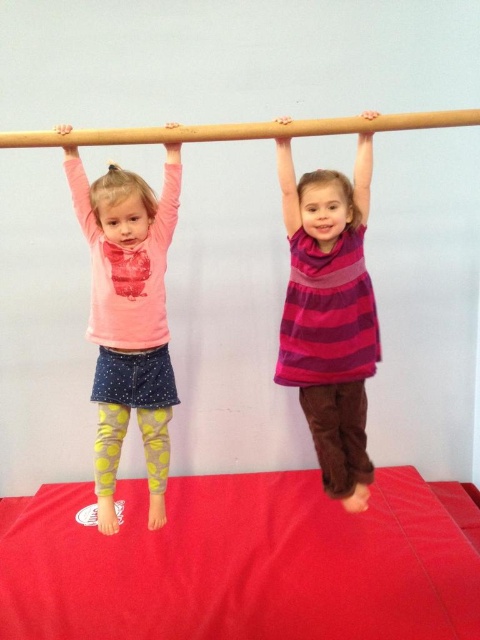
Does pink matte shirt at left have a greater height compared to wooden pole at center?

Answer: Correct, pink matte shirt at left is much taller as wooden pole at center.

Looking at this image, which is more to the left, pink matte shirt at left or wooden pole at center?

pink matte shirt at left

Does point (166, 225) come farther from viewer compared to point (4, 141)?

Yes, point (166, 225) is farther from viewer.

At what (x,y) coordinates should I click in order to perform the action: click on pink matte shirt at left. Please return your answer as a coordinate pair (x, y). This screenshot has height=640, width=480. Looking at the image, I should click on (129, 317).

Between purple striped dress at center and pink matte shirt at left, which one has more height?

pink matte shirt at left is taller.

Which of these two, purple striped dress at center or pink matte shirt at left, stands shorter?

Standing shorter between the two is purple striped dress at center.

Which is behind, point (328, 227) or point (146, 448)?

Point (146, 448)

I want to click on purple striped dress at center, so click(331, 316).

Between point (55, 486) and point (309, 221), which one is positioned behind?

The point (55, 486) is behind.

Who is higher up, red rubber mat at lower center or purple striped dress at center?

purple striped dress at center

Measure the distance between point (359, 634) and camera.

A distance of 6.76 feet exists between point (359, 634) and camera.

Identify the location of red rubber mat at lower center. (240, 563).